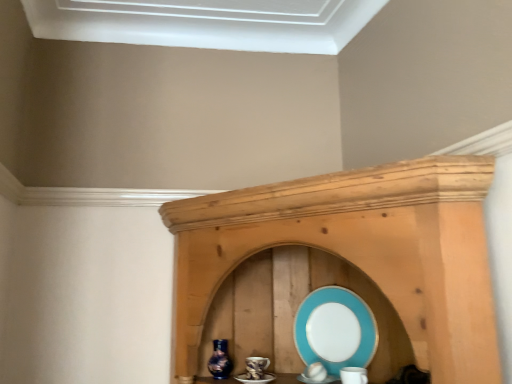
Question: Would you say shiny blue glass vase at center is a long distance from turquoise glossy platter at center?

Choices:
 (A) yes
 (B) no

Answer: (B)

Question: Does shiny blue glass vase at center have a smaller size compared to turquoise glossy platter at center?

Choices:
 (A) no
 (B) yes

Answer: (B)

Question: From the image's perspective, is shiny blue glass vase at center below turquoise glossy platter at center?

Choices:
 (A) no
 (B) yes

Answer: (B)

Question: From a real-world perspective, is shiny blue glass vase at center below turquoise glossy platter at center?

Choices:
 (A) no
 (B) yes

Answer: (B)

Question: Considering the relative positions of shiny blue glass vase at center and turquoise glossy platter at center in the image provided, is shiny blue glass vase at center to the left of turquoise glossy platter at center from the viewer's perspective?

Choices:
 (A) yes
 (B) no

Answer: (A)

Question: From the image's perspective, is shiny blue glass vase at center on turquoise glossy platter at center?

Choices:
 (A) yes
 (B) no

Answer: (B)

Question: Considering the relative sizes of turquoise glossy platter at center and shiny blue glass vase at center in the image provided, is turquoise glossy platter at center thinner than shiny blue glass vase at center?

Choices:
 (A) no
 (B) yes

Answer: (B)

Question: Is turquoise glossy platter at center far from shiny blue glass vase at center?

Choices:
 (A) no
 (B) yes

Answer: (A)

Question: Considering the relative sizes of turquoise glossy platter at center and shiny blue glass vase at center in the image provided, is turquoise glossy platter at center bigger than shiny blue glass vase at center?

Choices:
 (A) yes
 (B) no

Answer: (A)

Question: Is turquoise glossy platter at center turned away from shiny blue glass vase at center?

Choices:
 (A) yes
 (B) no

Answer: (B)

Question: Considering the relative positions of turquoise glossy platter at center and shiny blue glass vase at center in the image provided, is turquoise glossy platter at center to the right of shiny blue glass vase at center from the viewer's perspective?

Choices:
 (A) yes
 (B) no

Answer: (A)

Question: From the image's perspective, is turquoise glossy platter at center beneath shiny blue glass vase at center?

Choices:
 (A) no
 (B) yes

Answer: (A)

Question: From a real-world perspective, relative to shiny blue glass vase at center, is turquoise glossy platter at center vertically above or below?

Choices:
 (A) below
 (B) above

Answer: (B)